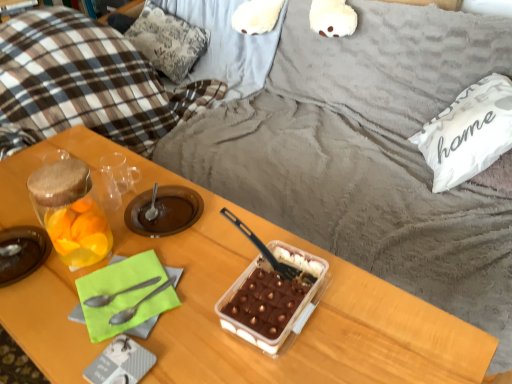
At what (x,y) coordinates should I click in order to perform the action: click on vacant area that is situated to the right of translucent glass jar at left. Please return your answer as a coordinate pair (x, y). The width and height of the screenshot is (512, 384). Looking at the image, I should click on (83, 259).